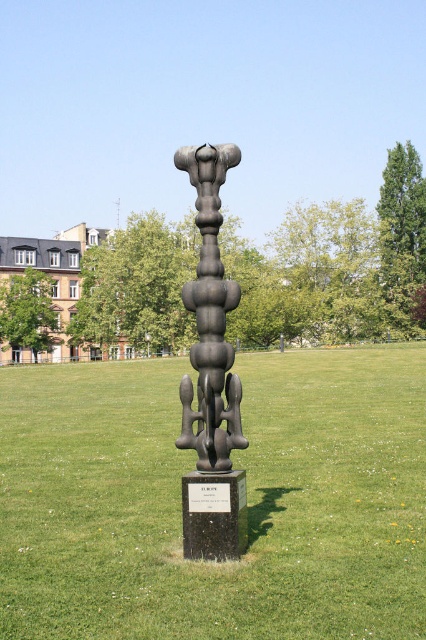
Is the position of black polished sculpture at center more distant than that of polished bronze sculpture at center?

No, it is not.

Between black polished sculpture at center and polished bronze sculpture at center, which one is positioned lower?

black polished sculpture at center is below.

Measure the distance between point [20,472] and camera.

Point [20,472] is 11.96 meters away from camera.

At what (x,y) coordinates should I click in order to perform the action: click on black polished sculpture at center. Please return your answer as a coordinate pair (x, y). Looking at the image, I should click on (247, 500).